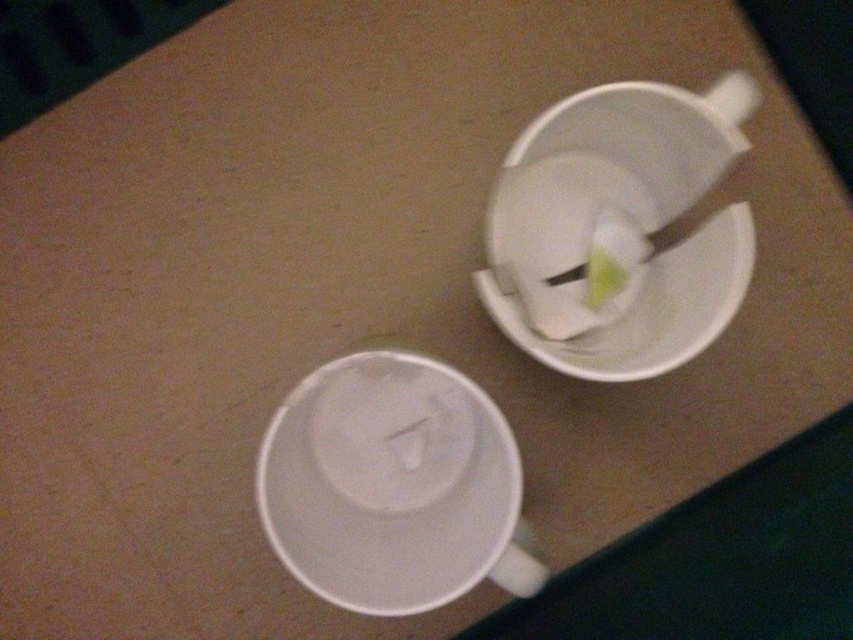
Question: Estimate the real-world distances between objects in this image. Which object is farther from the white matte saucer at center?

Choices:
 (A) white matte saucer at upper right
 (B) white matte saucer at lower left

Answer: (A)

Question: Which object is closer to the camera taking this photo?

Choices:
 (A) white matte saucer at lower left
 (B) white matte saucer at center

Answer: (A)

Question: Can you confirm if white matte saucer at lower left is wider than white matte saucer at center?

Choices:
 (A) no
 (B) yes

Answer: (B)

Question: Considering the relative positions of white matte saucer at center and white matte saucer at upper right in the image provided, where is white matte saucer at center located with respect to white matte saucer at upper right?

Choices:
 (A) right
 (B) left

Answer: (B)

Question: Can you confirm if white matte saucer at center is smaller than white matte saucer at upper right?

Choices:
 (A) yes
 (B) no

Answer: (A)

Question: Estimate the real-world distances between objects in this image. Which object is closer to the white matte saucer at lower left?

Choices:
 (A) white matte saucer at center
 (B) white matte saucer at upper right

Answer: (A)